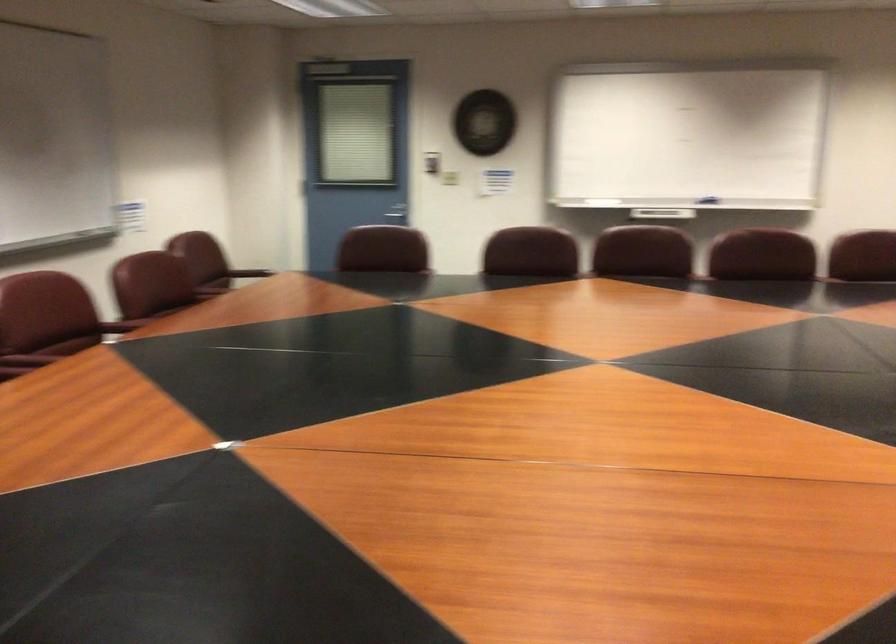
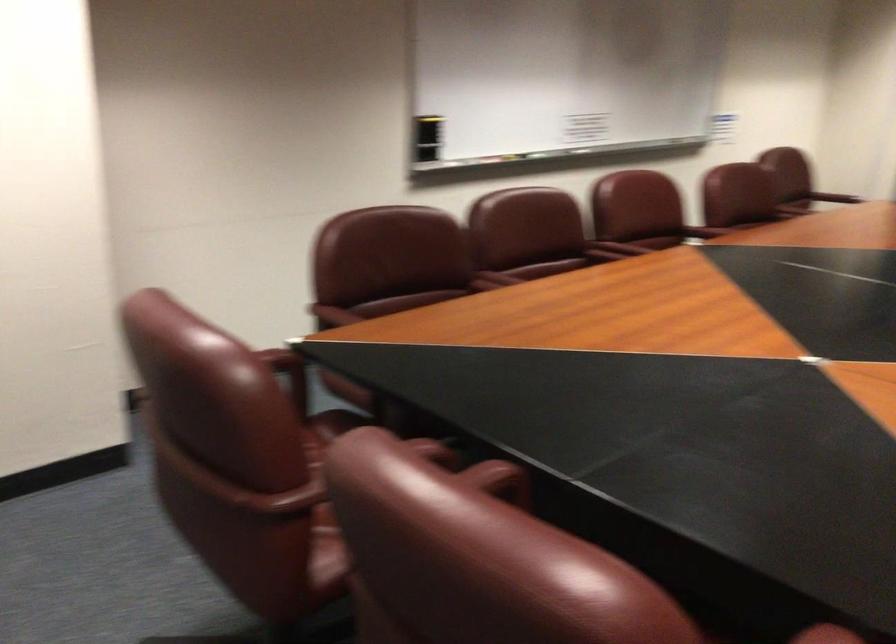
Where in the second image is the point corresponding to point (122, 328) from the first image?

(703, 232)